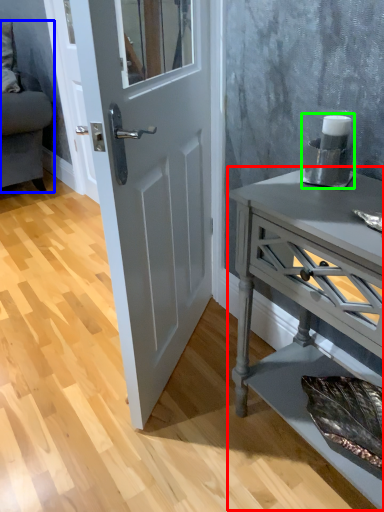
Question: Which object is the farthest from nightstand (highlighted by a red box)? Choose among these: studio couch (highlighted by a blue box) or appliance (highlighted by a green box).

Choices:
 (A) studio couch
 (B) appliance

Answer: (A)